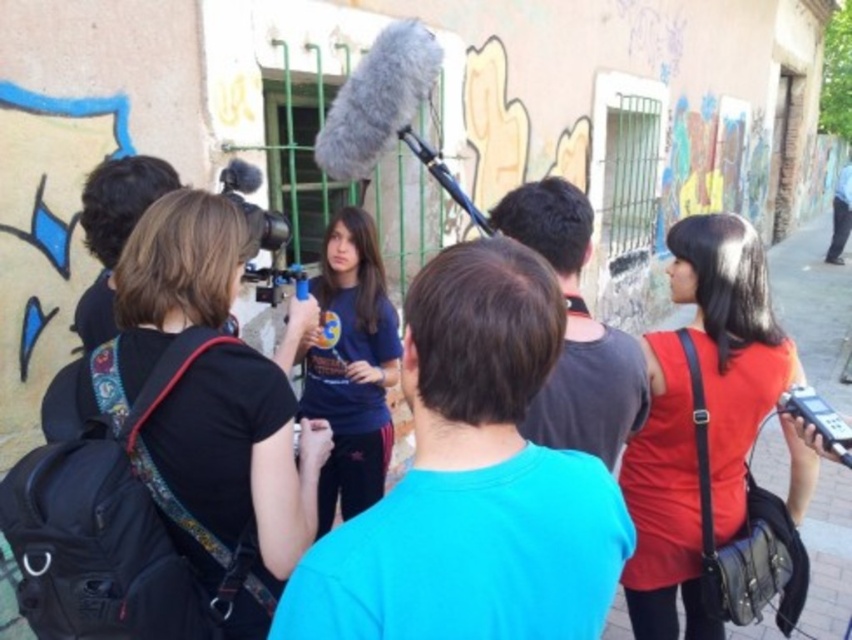
You are a photographer trying to capture a clear shot of the matte black video camera at center and the matte red dress at center. Which object should you focus on first to ensure it appears sharp in your photo?

The matte red dress at center is closer to the photographer, so focusing on it first will ensure it appears sharp. However, since the matte black video camera at center is behind it, adjusting focus might be needed for both to be clear.